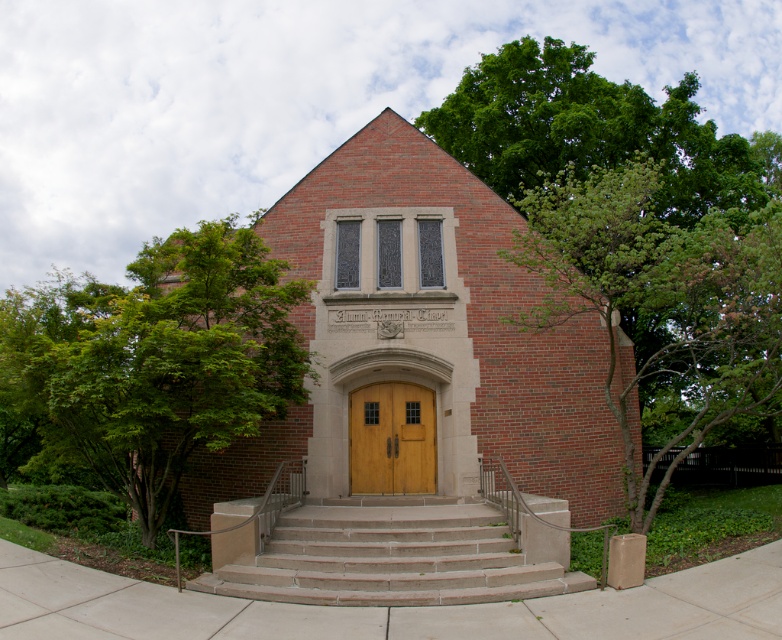
Who is more forward, [479,252] or [494,536]?

Point [494,536]

Does brick building at center appear under smooth concrete stairs at center?

Actually, brick building at center is above smooth concrete stairs at center.

Which is in front, point (235, 451) or point (289, 564)?

Point (289, 564) is more forward.

Image resolution: width=782 pixels, height=640 pixels. What are the coordinates of `brick building at center` in the screenshot? It's located at (425, 336).

Can you confirm if brick building at center is bigger than wooden at center?

No.

Measure the distance from brick building at center to wooden at center.

They are 1.87 meters apart.

Is point (293, 240) closer to camera compared to point (404, 484)?

No, (293, 240) is further to viewer.

The width and height of the screenshot is (782, 640). In order to click on brick building at center in this screenshot , I will do [425, 336].

The width and height of the screenshot is (782, 640). I want to click on green leafy tree at upper right, so click(635, 234).

Identify the location of green leafy tree at upper right. This screenshot has height=640, width=782. (635, 234).